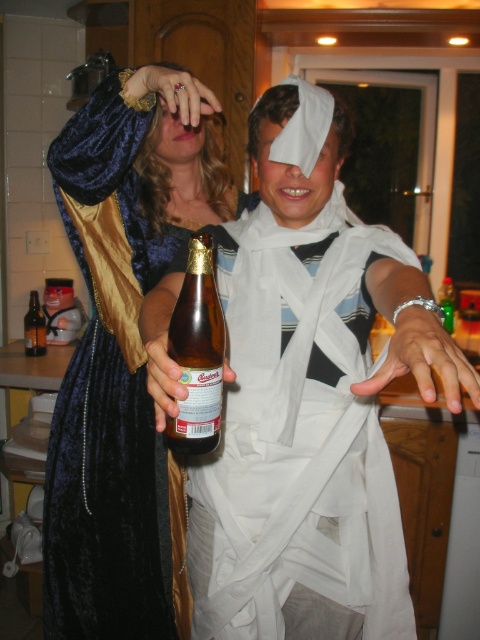
Is white paper robe at center wider than brown glass beer bottle at center?

Yes.

I want to click on white paper robe at center, so click(x=300, y=433).

The image size is (480, 640). Identify the location of white paper robe at center. (300, 433).

Locate an element on the screen. This screenshot has height=640, width=480. brown glass beer bottle at center is located at coordinates (197, 353).

Where is `brown glass beer bottle at center`? The height and width of the screenshot is (640, 480). brown glass beer bottle at center is located at coordinates (197, 353).

Is brown glass bottle at lower left thinner than brown glass bottle at center?

Yes.

Does brown glass bottle at lower left appear over brown glass bottle at center?

Actually, brown glass bottle at lower left is below brown glass bottle at center.

Does point (29, 348) come behind point (448, 328)?

No, (29, 348) is closer to viewer.

Where is `brown glass bottle at lower left`? brown glass bottle at lower left is located at coordinates (35, 326).